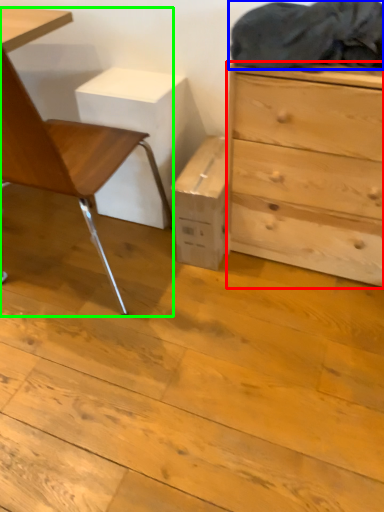
Question: Estimate the real-world distances between objects in this image. Which object is closer to chest of drawers (highlighted by a red box), laundry (highlighted by a blue box) or chair (highlighted by a green box)?

Choices:
 (A) laundry
 (B) chair

Answer: (A)